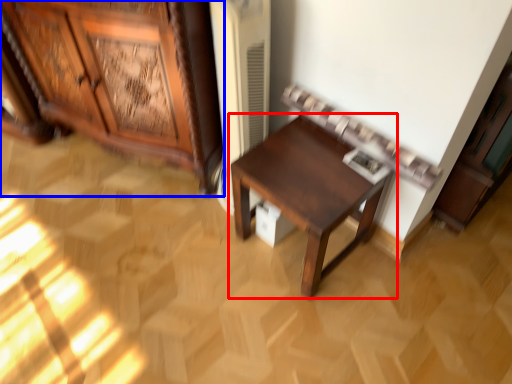
Question: Which of the following is the farthest to the observer, table (highlighted by a red box) or cabinetry (highlighted by a blue box)?

Choices:
 (A) table
 (B) cabinetry

Answer: (A)